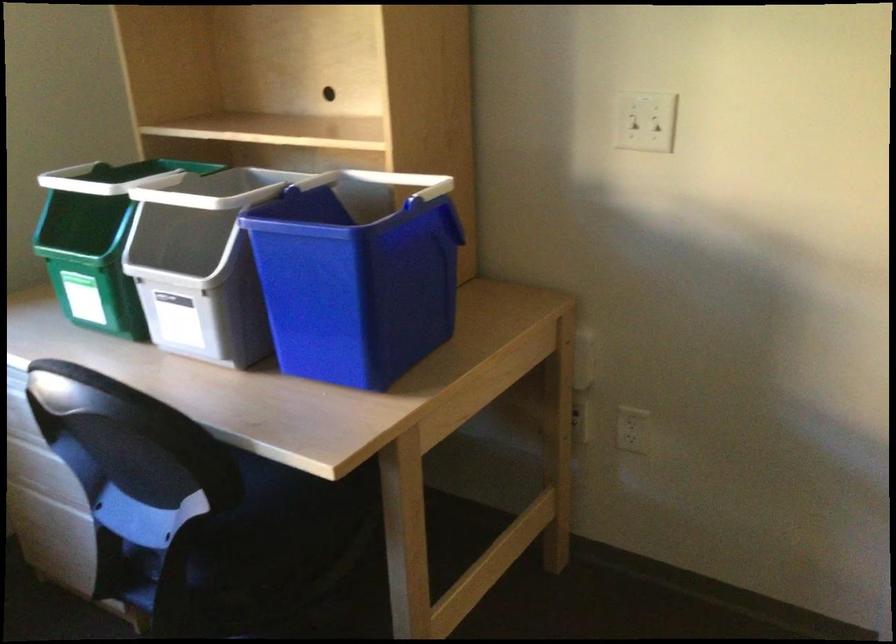
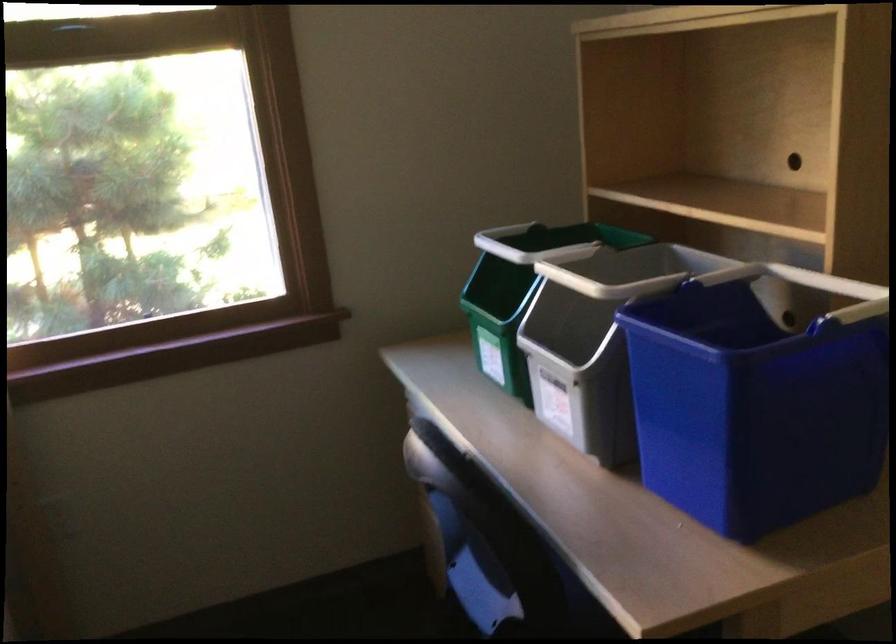
Question: How did the camera likely rotate?

Choices:
 (A) Left
 (B) Right
 (C) Up
 (D) Down

Answer: (A)